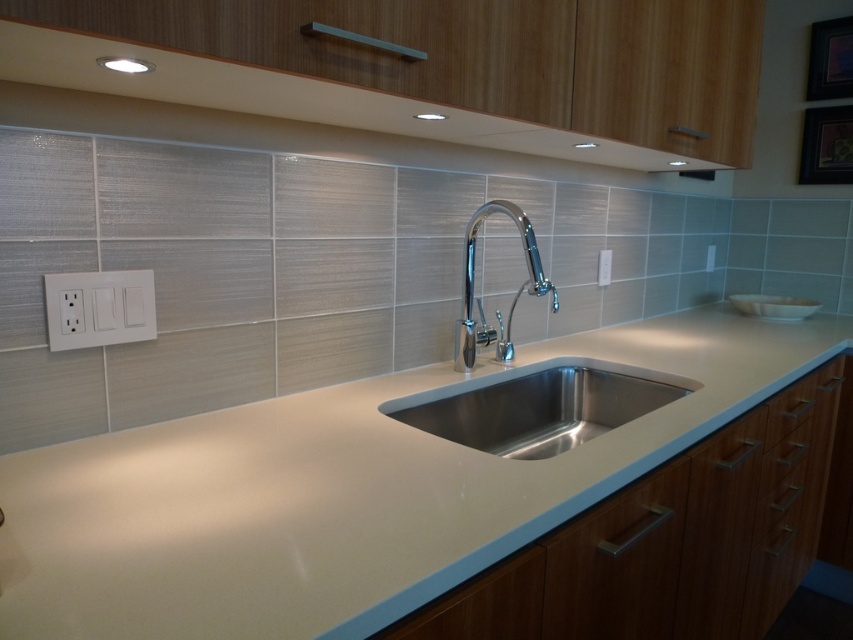
Question: Is white plastic/light switch at left closer to the viewer compared to wooden drawer at lower right?

Choices:
 (A) yes
 (B) no

Answer: (A)

Question: Which point is closer to the camera taking this photo?

Choices:
 (A) (619, 410)
 (B) (786, 420)
 (C) (112, 284)

Answer: (C)

Question: Is white plastic/light switch at left thinner than polished chrome faucet at center?

Choices:
 (A) yes
 (B) no

Answer: (A)

Question: Which object is the farthest from the white plastic electric outlet at upper center?

Choices:
 (A) white plastic/light switch at left
 (B) wooden drawer at lower right

Answer: (A)

Question: Observing the image, what is the correct spatial positioning of polished chrome faucet at center in reference to white plastic electric outlet at upper center?

Choices:
 (A) right
 (B) left

Answer: (B)

Question: Which point is farther from the camera taking this photo?

Choices:
 (A) (471, 408)
 (B) (608, 262)

Answer: (B)